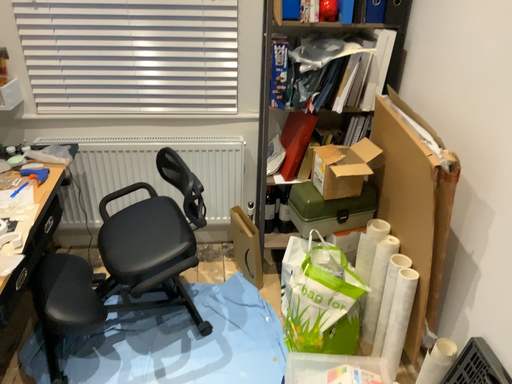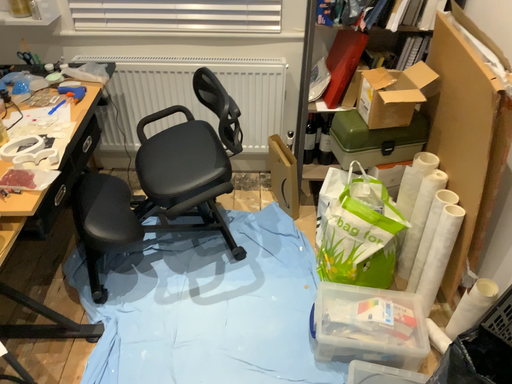
Question: How did the camera likely rotate when shooting the video?

Choices:
 (A) rotated upward
 (B) rotated downward

Answer: (B)